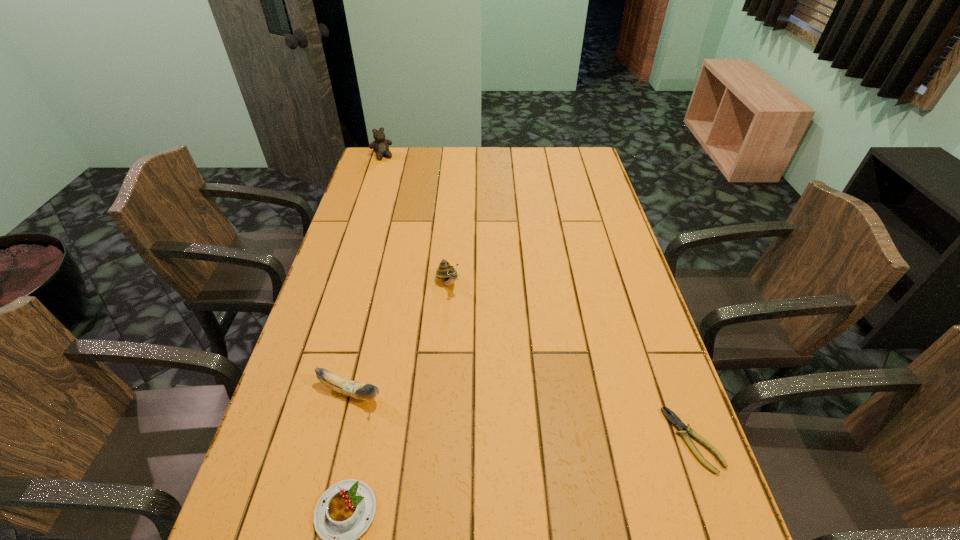
This screenshot has height=540, width=960. Identify the location of free space between the shortest object and the snail. (570, 362).

Locate an element on the screen. Image resolution: width=960 pixels, height=540 pixels. empty location between the second object from right to left and the banana is located at coordinates (399, 339).

Where is `empty space between the rightmost object and the farthest object`? Image resolution: width=960 pixels, height=540 pixels. empty space between the rightmost object and the farthest object is located at coordinates (538, 298).

Where is `free spot between the shortest object and the farthest object`? Image resolution: width=960 pixels, height=540 pixels. free spot between the shortest object and the farthest object is located at coordinates (538, 298).

Locate an element on the screen. vacant area that lies between the shortest object and the banana is located at coordinates (521, 416).

Locate an element on the screen. This screenshot has width=960, height=540. the third closest object to the snail is located at coordinates 676,421.

Select which object appears as the third closest to the pudding. Please provide its 2D coordinates. Your answer should be formatted as a tuple, i.e. [(x, y)], where the tuple contains the x and y coordinates of a point satisfying the conditions above.

[(676, 421)]

I want to click on free point that satisfies the following two spatial constraints: 1. on the front side of the pliers; 2. on the left side of the snail, so 436,440.

The height and width of the screenshot is (540, 960). Identify the location of free space in the image that satisfies the following two spatial constraints: 1. on the front side of the rightmost object; 2. on the left side of the snail. tap(436, 440).